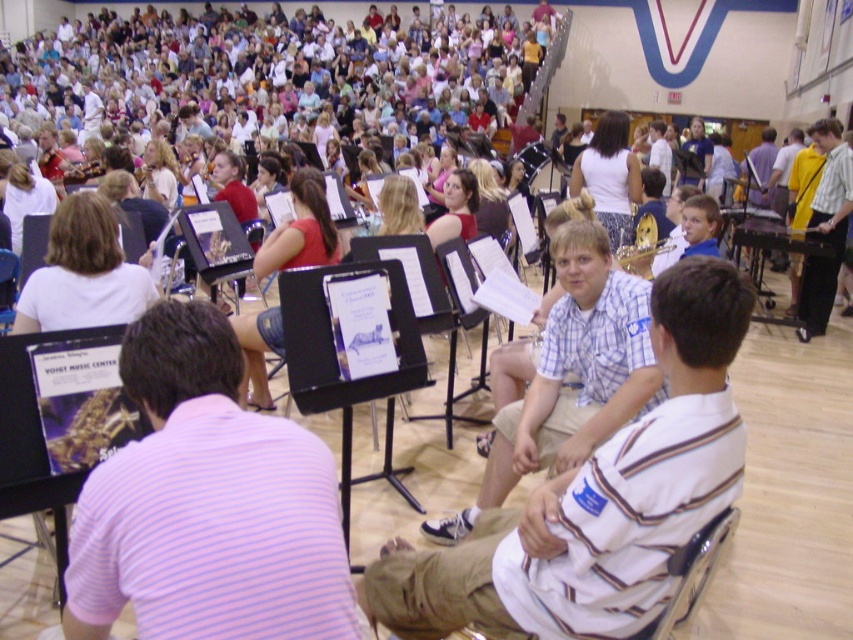
You are a photographer in the audience taking pictures of the youth orchestra. You notice two musicians wearing shirts that stand out. The first is a purple striped shirt at center, and the second is a white cotton shirt at upper center. Which musician is positioned to the left side of the other?

The purple striped shirt at center is to the left of the white cotton shirt at upper center.

You are a photographer in the audience and want to capture a photo of the purple striped shirt at center and the white cotton shirt at upper left. However, you want to ensure that both shirts are fully visible in the photo. Based on their positions, can you position yourself in a way that both shirts are visible without any obstruction?

The purple striped shirt at center is in front of the white cotton shirt at upper left, so positioning yourself to the side or above the purple striped shirt at center would allow you to see both shirts without obstruction.